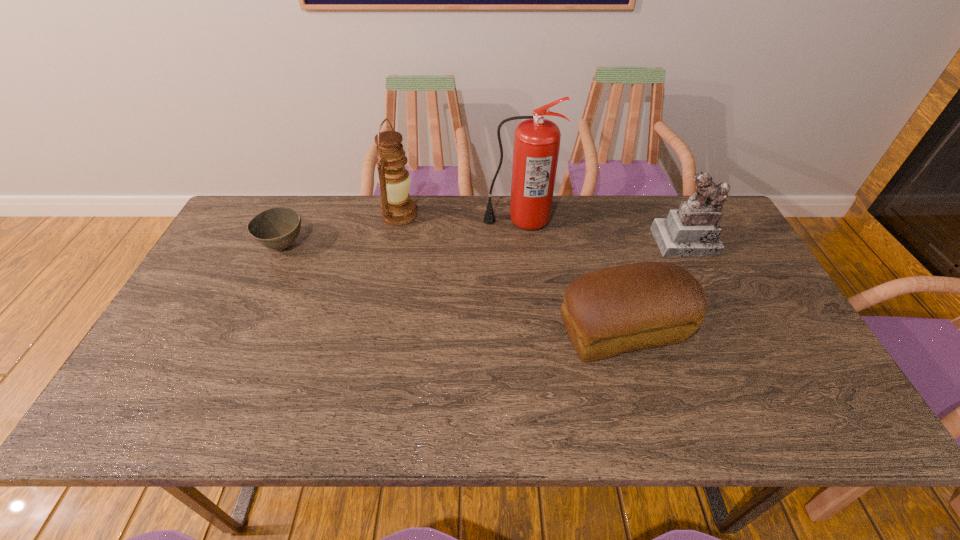
You are a GUI agent. You are given a task and a screenshot of the screen. Output one action in this format:
    pyautogui.click(x=<x>, y=<y>)
    Task: Click on the object that is positioned at the far left corner
    
    Given the screenshot: What is the action you would take?
    pyautogui.click(x=276, y=228)

Locate an element on the screen. object positioned at the far right corner is located at coordinates (691, 231).

I want to click on vacant space at the far edge, so click(457, 222).

Locate an element on the screen. Image resolution: width=960 pixels, height=540 pixels. vacant space at the near edge of the desktop is located at coordinates (323, 408).

Find the location of `blank space at the left edge of the desktop`. blank space at the left edge of the desktop is located at coordinates 238,309.

Locate an element on the screen. vacant space at the near left corner of the desktop is located at coordinates (187, 411).

Where is `free space between the fourth shortest object and the third tallest object`? Image resolution: width=960 pixels, height=540 pixels. free space between the fourth shortest object and the third tallest object is located at coordinates (542, 228).

Identify the location of vacant area that lies between the second object from left to right and the shortest object. This screenshot has height=540, width=960. (342, 231).

Locate an element on the screen. The height and width of the screenshot is (540, 960). free space between the leftmost object and the tallest object is located at coordinates (401, 234).

Locate an element on the screen. vacant area between the leftmost object and the tallest object is located at coordinates (401, 234).